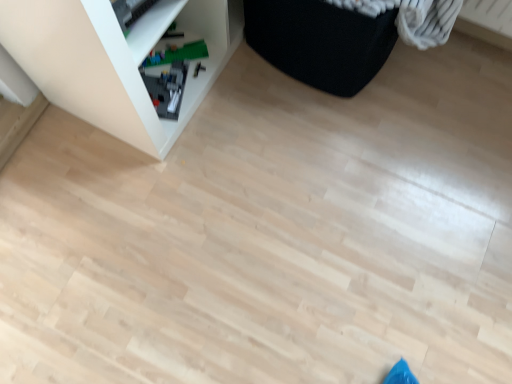
Find the location of a particular element. The image size is (512, 384). free area in between white plastic shelf at upper left and black fabric ottoman at upper right is located at coordinates (258, 116).